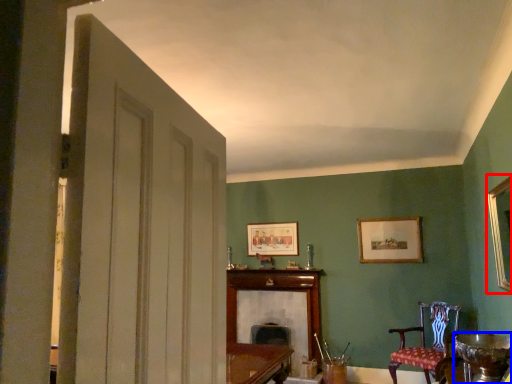
Question: Which object appears closest to the camera in this image, picture frame (highlighted by a red box) or round table (highlighted by a blue box)?

Choices:
 (A) picture frame
 (B) round table

Answer: (A)